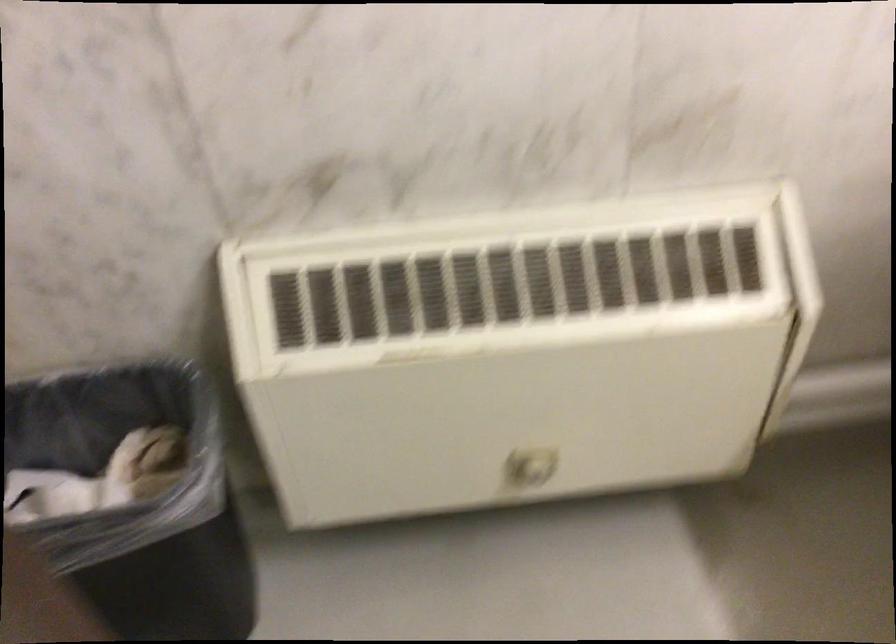
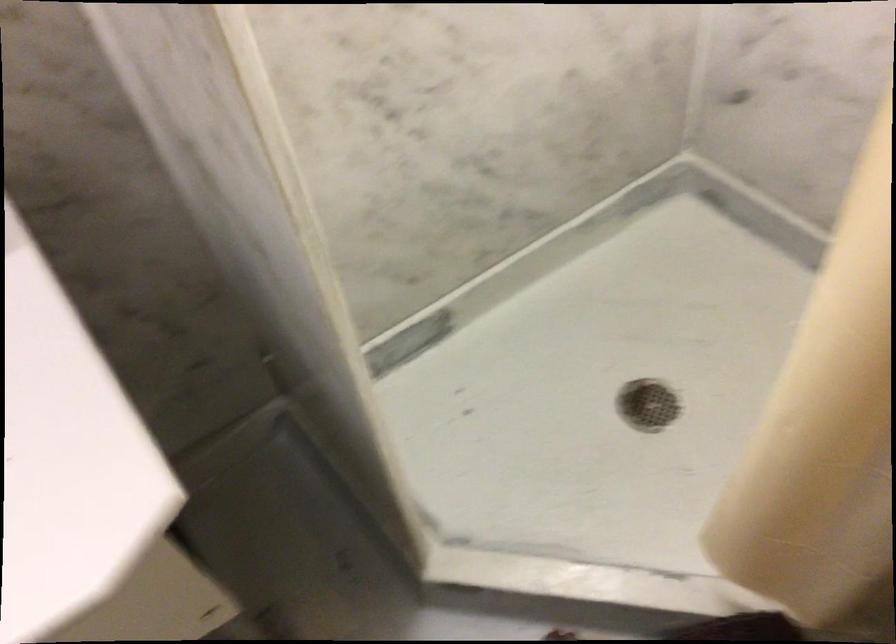
Based on the photo, the first image is from the beginning of the video and the second image is from the end. How did the camera likely rotate when shooting the video?

The camera's rotation is toward right-down.